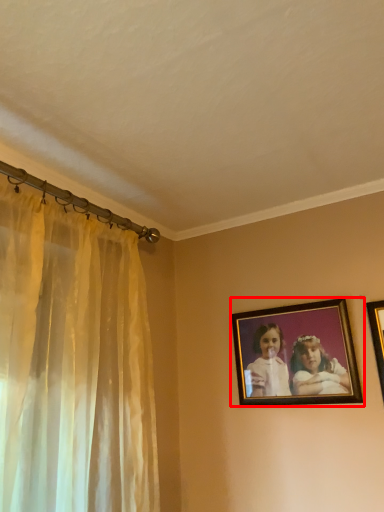
Question: Considering the relative positions of picture frame (annotated by the red box) and picture frame in the image provided, where is picture frame (annotated by the red box) located with respect to the staircase?

Choices:
 (A) left
 (B) right

Answer: (A)